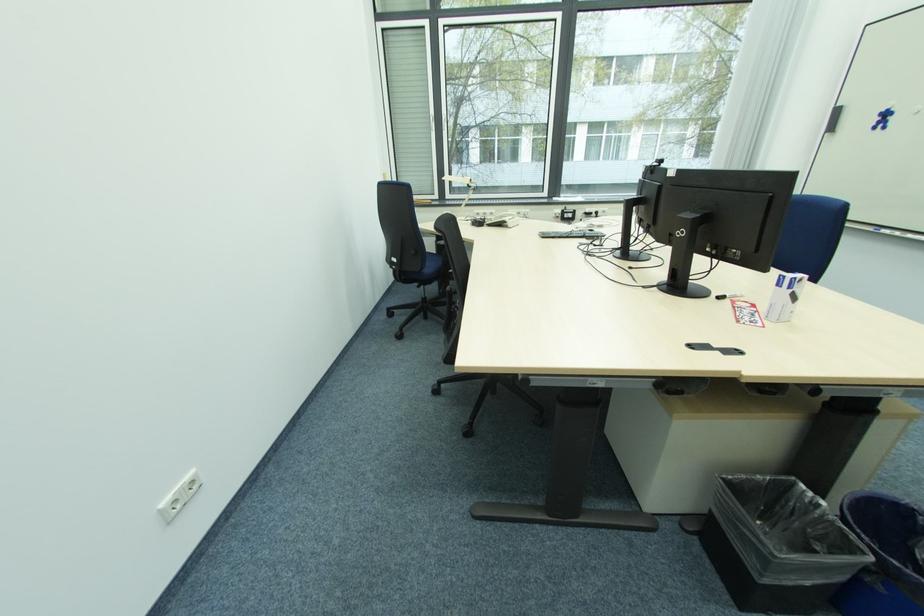
This screenshot has width=924, height=616. In order to click on white telephone in this screenshot , I will do `click(503, 220)`.